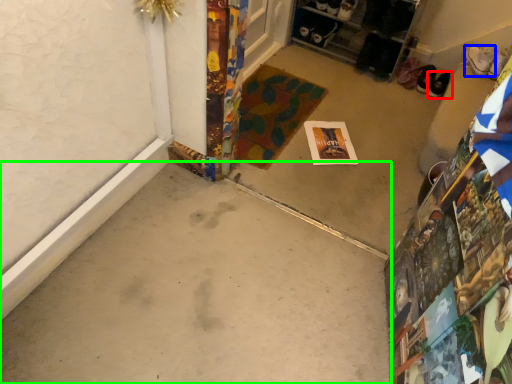
Question: Estimate the real-world distances between objects in this image. Which object is farther from footwear (highlighted by a red box), footwear (highlighted by a blue box) or concrete (highlighted by a green box)?

Choices:
 (A) footwear
 (B) concrete

Answer: (B)